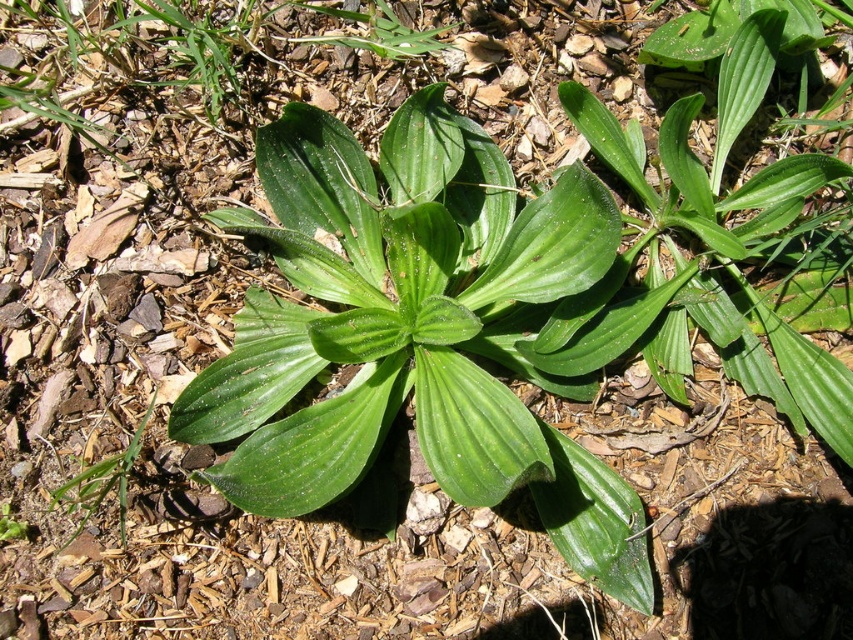
Question: Can you confirm if green matte leafy plant at center is positioned to the right of green leafy plant at lower left?

Choices:
 (A) no
 (B) yes

Answer: (B)

Question: Considering the relative positions of green glossy leaf at center and green leafy plant at lower left in the image provided, where is green glossy leaf at center located with respect to green leafy plant at lower left?

Choices:
 (A) above
 (B) below

Answer: (A)

Question: Is green matte leafy plant at center positioned behind green glossy leaf at center?

Choices:
 (A) yes
 (B) no

Answer: (B)

Question: Which object appears farthest from the camera in this image?

Choices:
 (A) green matte leafy plant at center
 (B) green glossy leaf at center
 (C) green leafy plant at lower left

Answer: (C)

Question: Among these objects, which one is nearest to the camera?

Choices:
 (A) green leafy plant at lower left
 (B) green glossy leaf at center
 (C) green matte leafy plant at center

Answer: (C)

Question: Which point is closer to the camera?

Choices:
 (A) (477, 481)
 (B) (132, 444)

Answer: (A)